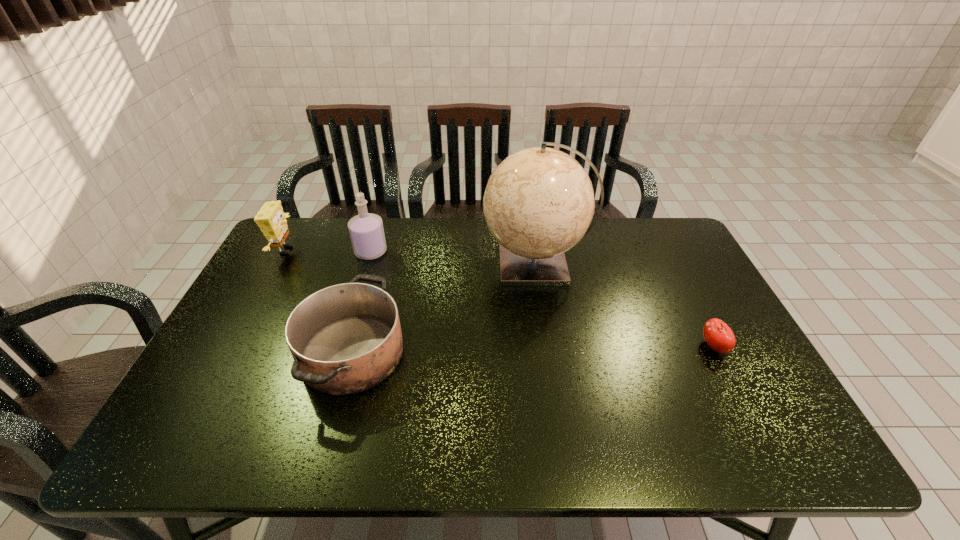
Locate an element on the screen. globe is located at coordinates (538, 203).

You are a GUI agent. You are given a task and a screenshot of the screen. Output one action in this format:
    pyautogui.click(x=<x>, y=<y>)
    Task: Click on the second object from right to left
    The image size is (960, 540).
    Given the screenshot: What is the action you would take?
    pyautogui.click(x=538, y=203)

Where is `the second tallest object`? This screenshot has width=960, height=540. the second tallest object is located at coordinates (366, 230).

The height and width of the screenshot is (540, 960). Find the location of `sponge`. sponge is located at coordinates (271, 219).

In order to click on the third shortest object in this screenshot , I will do `click(271, 219)`.

At what (x,y) coordinates should I click in order to perform the action: click on saucepan. Please return your answer as a coordinate pair (x, y). Looking at the image, I should click on (346, 338).

Image resolution: width=960 pixels, height=540 pixels. What are the coordinates of `apple` in the screenshot? It's located at [x=717, y=334].

The width and height of the screenshot is (960, 540). What are the coordinates of `the rightmost object` in the screenshot? It's located at (717, 334).

This screenshot has height=540, width=960. In order to click on free space located on the surface of the globe showing Europe and Africa in this screenshot , I will do `click(375, 264)`.

Find the location of a particular element. This screenshot has width=960, height=540. vacant area situated on the surface of the globe showing Europe and Africa is located at coordinates (420, 264).